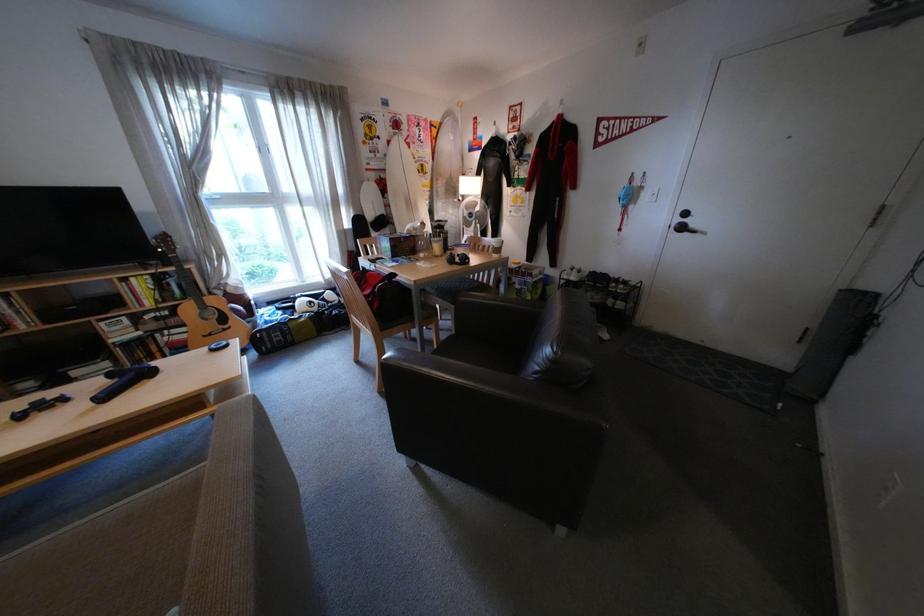
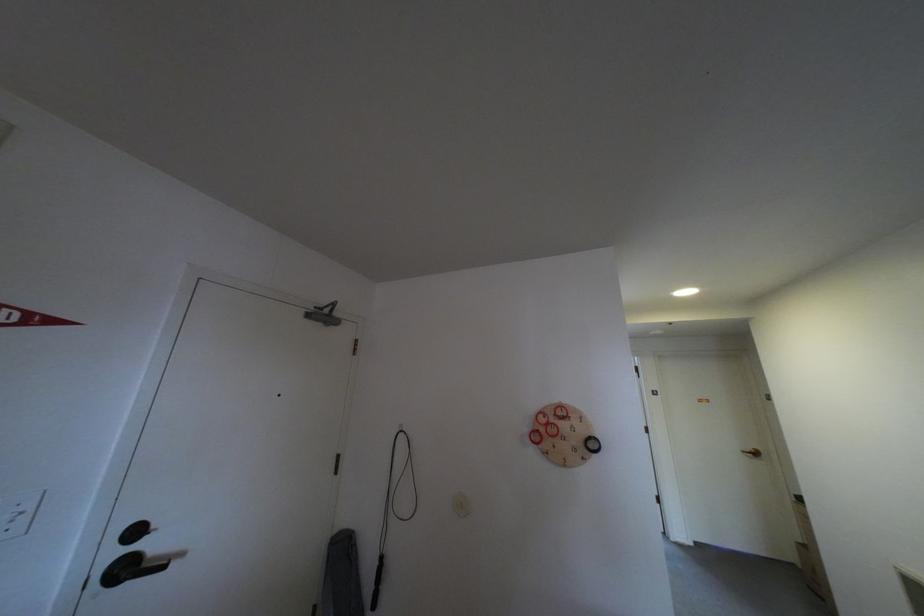
The point at (696,229) is marked in the first image. Where is the corresponding point in the second image?

(140, 570)